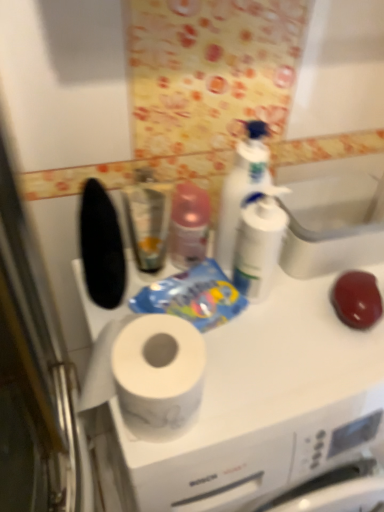
Question: Is white glossy bottle at upper center oriented away from white matte countertop at center?

Choices:
 (A) yes
 (B) no

Answer: (B)

Question: Is white glossy bottle at upper center aimed at white matte countertop at center?

Choices:
 (A) no
 (B) yes

Answer: (A)

Question: Is white glossy bottle at upper center further to the viewer compared to white matte countertop at center?

Choices:
 (A) no
 (B) yes

Answer: (B)

Question: Is white glossy bottle at upper center taller than white matte countertop at center?

Choices:
 (A) no
 (B) yes

Answer: (A)

Question: Does white glossy bottle at upper center have a lesser width compared to white matte countertop at center?

Choices:
 (A) yes
 (B) no

Answer: (A)

Question: Is point (180, 412) positioned closer to the camera than point (375, 203)?

Choices:
 (A) closer
 (B) farther

Answer: (A)

Question: From their relative heights in the image, would you say white matte countertop at center is taller or shorter than white glossy sink at upper center?

Choices:
 (A) tall
 (B) short

Answer: (A)

Question: Considering the positions of white matte countertop at center and white glossy sink at upper center in the image, is white matte countertop at center wider or thinner than white glossy sink at upper center?

Choices:
 (A) wide
 (B) thin

Answer: (A)

Question: Do you think white matte countertop at center is within white glossy sink at upper center, or outside of it?

Choices:
 (A) outside
 (B) inside

Answer: (A)

Question: From the image's perspective, is white plastic pump bottle at center above or below white glossy sink at upper center?

Choices:
 (A) below
 (B) above

Answer: (A)

Question: Looking at the image, does white plastic pump bottle at center seem bigger or smaller compared to white glossy sink at upper center?

Choices:
 (A) big
 (B) small

Answer: (B)

Question: Looking at their shapes, would you say white plastic pump bottle at center is wider or thinner than white glossy sink at upper center?

Choices:
 (A) thin
 (B) wide

Answer: (A)

Question: Is white plastic pump bottle at center taller or shorter than white glossy sink at upper center?

Choices:
 (A) tall
 (B) short

Answer: (A)

Question: In terms of size, does white matte countertop at center appear bigger or smaller than metallic silver mouthwash at center?

Choices:
 (A) big
 (B) small

Answer: (A)

Question: In terms of width, does white matte countertop at center look wider or thinner when compared to metallic silver mouthwash at center?

Choices:
 (A) thin
 (B) wide

Answer: (B)